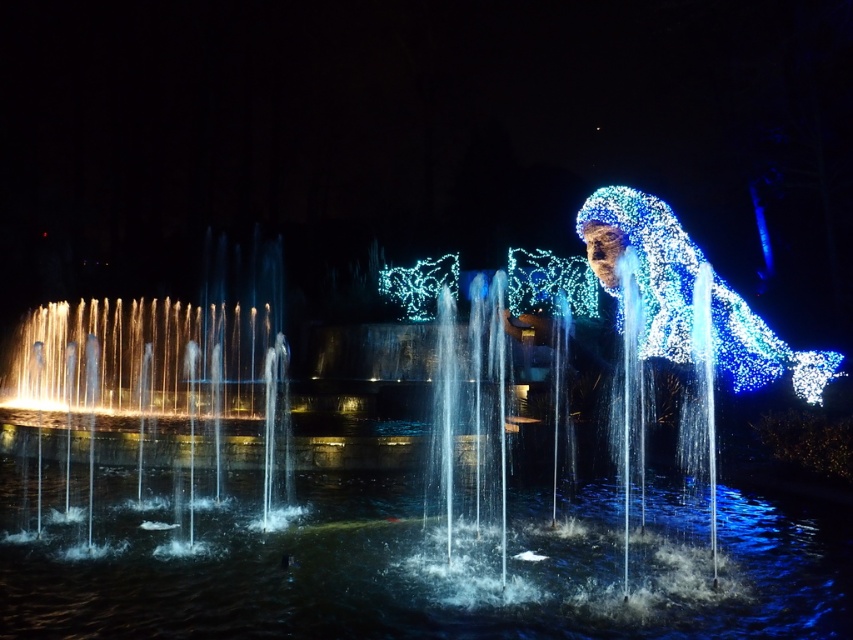
You are standing at the edge of the fountain and want to walk towards the illuminated wireframe figure at right. Which direction should you move to avoid stepping into the clear water at center?

The clear water at center is in front of the illuminated wireframe figure at right, so to avoid stepping into it, you should move to the right or left side around the clear water at center to reach the illuminated wireframe figure at right.

You are standing at the point marked as point (413, 570) in the fountain scene. What is located exactly at that point?

The point (413, 570) is occupied by clear water at center.

You are standing at the point marked as point (45, 541) in the image. The fountain has a safety zone that requires visitors to stay at least 40 meters away from the center of the fountain. Can you safely enter the area without violating the safety zone?

The distance between point (45, 541) and the viewer is 38.76 meters. Since the safety zone requires staying at least 40 meters away, you are currently 1.24 meters too close to the fountain center. Therefore, you cannot safely enter the area without violating the safety zone.